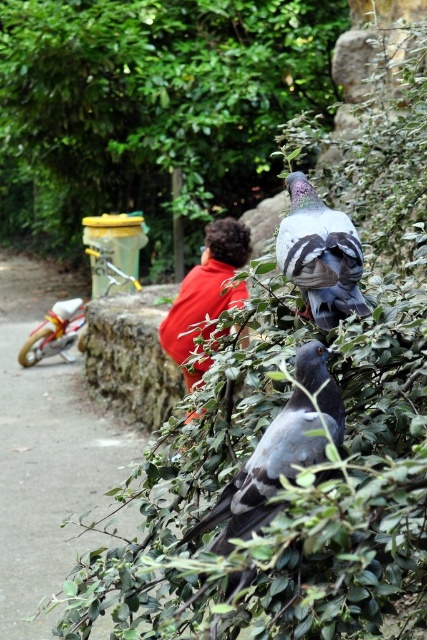
You are a photographer trying to capture a clear photo of the red cotton shirt at center without the green leafy tree at upper center blocking it. What should you do?

The green leafy tree at upper center is closer to you than the red cotton shirt at center, so you should move your camera position to the side or lower your angle to avoid the tree blocking the view of the shirt.

You are standing in the scene and see the point marked at coordinates (x=265, y=474). What object is located at that point?

The point at coordinates (x=265, y=474) indicates a gray matte pigeon at center.

You are standing at the camera position and want to feed the gray matte pigeon at center. If your hand can reach 6 feet, will you be able to reach it?

The gray matte pigeon at center is 7.21 feet away from the camera, so your hand can only reach 6 feet. Therefore, you cannot reach the gray matte pigeon at center.